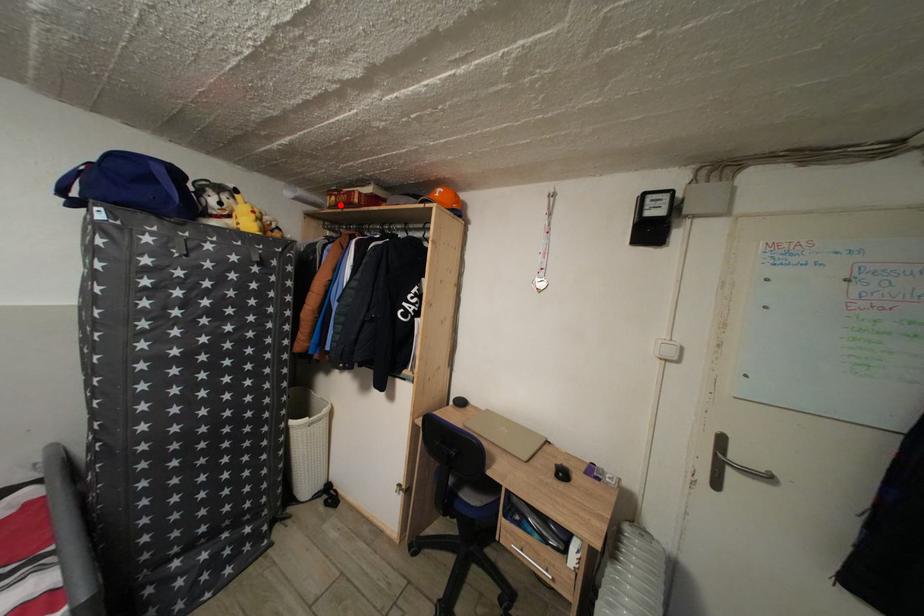
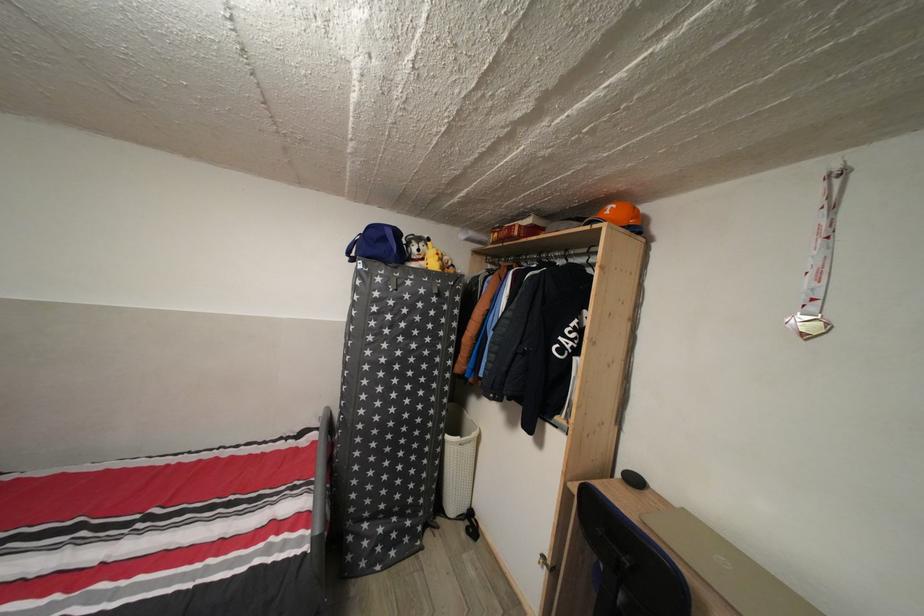
The point at the highlighted location is marked in the first image. Where is the corresponding point in the second image?

(503, 241)